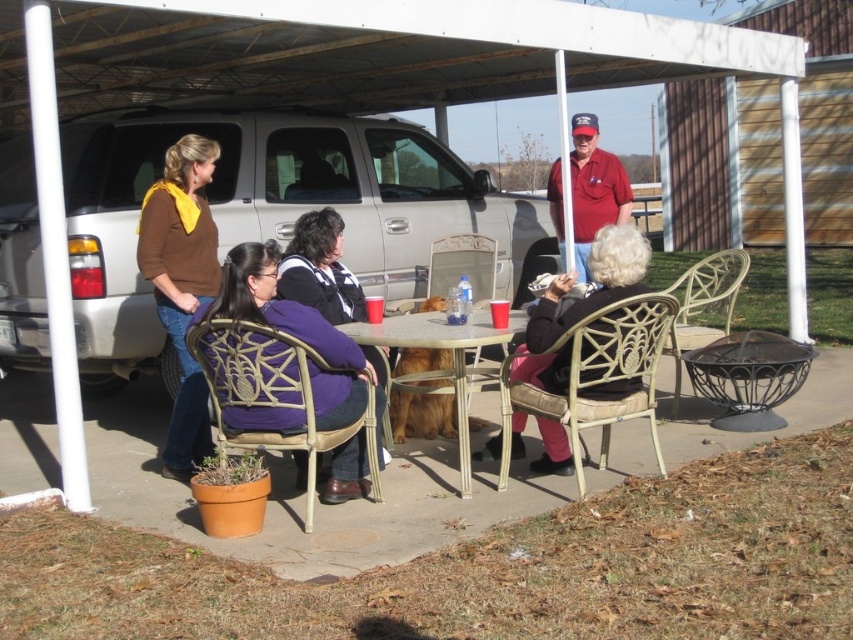
Does brown sweater at left lie in front of red cotton shirt at center?

Yes, it is in front of red cotton shirt at center.

Is brown sweater at left shorter than red cotton shirt at center?

Incorrect, brown sweater at left's height does not fall short of red cotton shirt at center's.

Where is `brown sweater at left`? The height and width of the screenshot is (640, 853). brown sweater at left is located at coordinates (181, 284).

Which is behind, point (213, 244) or point (456, 408)?

The point (213, 244) is behind.

Who is higher up, brown sweater at left or translucent glass table at center?

brown sweater at left

Measure the distance between point [196,416] and camera.

The distance of point [196,416] from camera is 5.32 meters.

This screenshot has width=853, height=640. I want to click on brown sweater at left, so click(x=181, y=284).

Is translucent glass table at center smaller than purple sweater at center?

Actually, translucent glass table at center might be larger than purple sweater at center.

Can you confirm if translucent glass table at center is taller than purple sweater at center?

No, translucent glass table at center is not taller than purple sweater at center.

Does point (463, 438) lie behind point (300, 285)?

No, it is not.

I want to click on translucent glass table at center, so click(451, 360).